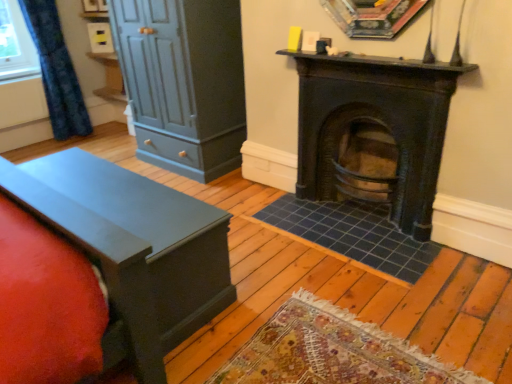
Question: Is the depth of blue textured curtain at left less than that of matte dark gray dresser at left?

Choices:
 (A) yes
 (B) no

Answer: (B)

Question: Considering the relative positions of blue textured curtain at left and matte dark gray dresser at left in the image provided, is blue textured curtain at left to the right of matte dark gray dresser at left from the viewer's perspective?

Choices:
 (A) no
 (B) yes

Answer: (A)

Question: Can you confirm if blue textured curtain at left is bigger than matte dark gray dresser at left?

Choices:
 (A) no
 (B) yes

Answer: (A)

Question: Considering the relative sizes of blue textured curtain at left and matte dark gray dresser at left in the image provided, is blue textured curtain at left taller than matte dark gray dresser at left?

Choices:
 (A) no
 (B) yes

Answer: (B)

Question: Is matte dark gray dresser at left at the back of blue textured curtain at left?

Choices:
 (A) yes
 (B) no

Answer: (B)

Question: Considering the relative sizes of blue textured curtain at left and matte dark gray dresser at left in the image provided, is blue textured curtain at left smaller than matte dark gray dresser at left?

Choices:
 (A) yes
 (B) no

Answer: (A)

Question: Considering the relative positions of matte dark gray dresser at left and dark brown wood burning stove at center in the image provided, is matte dark gray dresser at left to the left of dark brown wood burning stove at center from the viewer's perspective?

Choices:
 (A) no
 (B) yes

Answer: (B)

Question: Is the position of matte dark gray dresser at left more distant than that of dark brown wood burning stove at center?

Choices:
 (A) yes
 (B) no

Answer: (A)

Question: Can you confirm if matte dark gray dresser at left is thinner than dark brown wood burning stove at center?

Choices:
 (A) yes
 (B) no

Answer: (B)

Question: From a real-world perspective, is matte dark gray dresser at left located beneath dark brown wood burning stove at center?

Choices:
 (A) no
 (B) yes

Answer: (A)

Question: Can you confirm if matte dark gray dresser at left is positioned to the right of dark brown wood burning stove at center?

Choices:
 (A) yes
 (B) no

Answer: (B)

Question: Is matte dark gray dresser at left closer to camera compared to dark brown wood burning stove at center?

Choices:
 (A) no
 (B) yes

Answer: (A)

Question: Considering the relative positions of dark brown wood burning stove at center and matte dark gray dresser at left in the image provided, is dark brown wood burning stove at center to the right of matte dark gray dresser at left from the viewer's perspective?

Choices:
 (A) yes
 (B) no

Answer: (A)